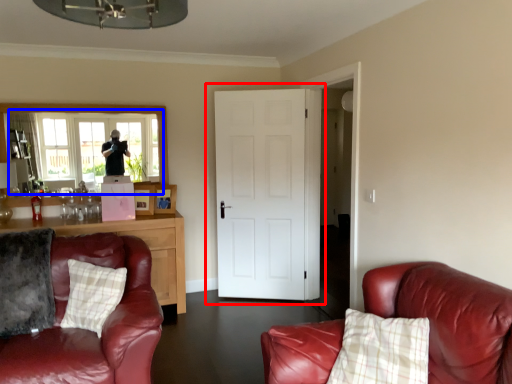
Question: Which point is further to the camera, door (highlighted by a red box) or window (highlighted by a blue box)?

Choices:
 (A) door
 (B) window

Answer: (A)